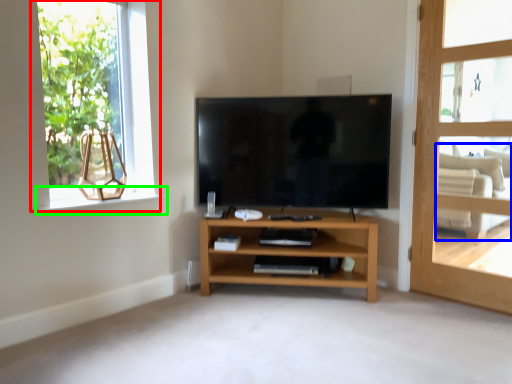
Question: Based on their relative distances, which object is nearer to window (highlighted by a red box)? Choose from armchair (highlighted by a blue box) and window sill (highlighted by a green box).

Choices:
 (A) armchair
 (B) window sill

Answer: (B)